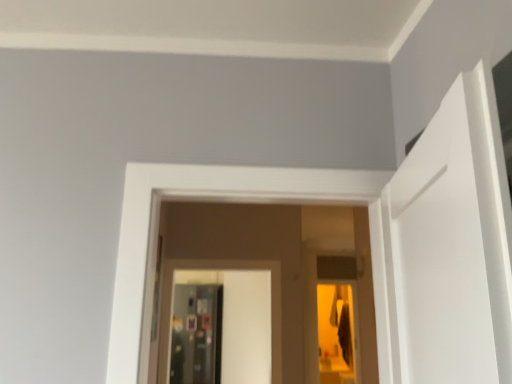
Question: Is metallic silver screen door at center, the 2th screen door in the back-to-front sequence, inside the boundaries of metallic reflective screen door at center, positioned as the second screen door in front-to-back order, or outside?

Choices:
 (A) inside
 (B) outside

Answer: (B)

Question: Visually, is metallic silver screen door at center, marked as the first screen door in a front-to-back arrangement, positioned to the left or to the right of metallic reflective screen door at center, which is the 1th screen door in left-to-right order?

Choices:
 (A) right
 (B) left

Answer: (A)

Question: From a real-world perspective, is metallic silver screen door at center, acting as the 2th screen door starting from the left, above or below metallic reflective screen door at center, positioned as the second screen door in front-to-back order?

Choices:
 (A) below
 (B) above

Answer: (B)

Question: Relative to metallic silver screen door at center, marked as the first screen door in a front-to-back arrangement, is metallic reflective screen door at center, which is the 1th screen door in left-to-right order, in front or behind?

Choices:
 (A) behind
 (B) front

Answer: (A)

Question: From a real-world perspective, is metallic reflective screen door at center, placed as the 2th screen door when sorted from right to left, above or below metallic silver screen door at center, the 2th screen door in the back-to-front sequence?

Choices:
 (A) above
 (B) below

Answer: (B)

Question: From their relative heights in the image, would you say metallic reflective screen door at center, which is the 1th screen door in left-to-right order, is taller or shorter than metallic silver screen door at center, acting as the 2th screen door starting from the left?

Choices:
 (A) tall
 (B) short

Answer: (A)

Question: In the image, is metallic reflective screen door at center, placed as the 2th screen door when sorted from right to left, on the left side or the right side of metallic silver screen door at center, acting as the 2th screen door starting from the left?

Choices:
 (A) right
 (B) left

Answer: (B)